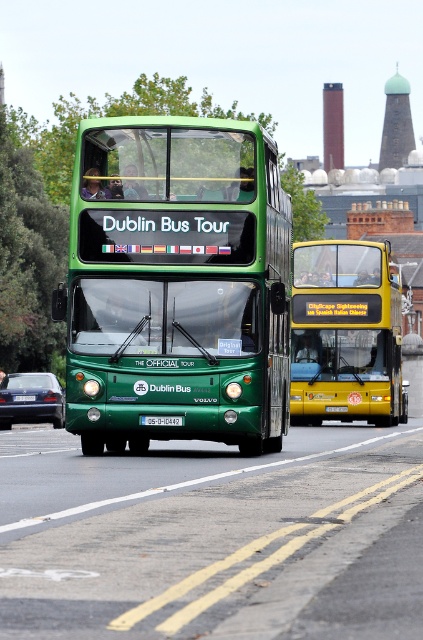
You are a delivery driver who needs to pass between the yellow metallic bus at center and the matte blue sedan at lower left. Your truck is 12 feet wide. Can you safely navigate through the gap between them?

The gap between the yellow metallic bus at center and the matte blue sedan at lower left is 28.82 feet. Since your truck is only 12 feet wide, there is sufficient space to safely pass through the gap between them.

You are a photographer planning to take a photo of the yellow metallic bus at center and the matte blue sedan at lower left. Which vehicle should you focus on if you want to capture the larger one in your shot?

The yellow metallic bus at center is larger in size than the matte blue sedan at lower left, so you should focus on the yellow metallic bus at center to capture the larger one in your shot.